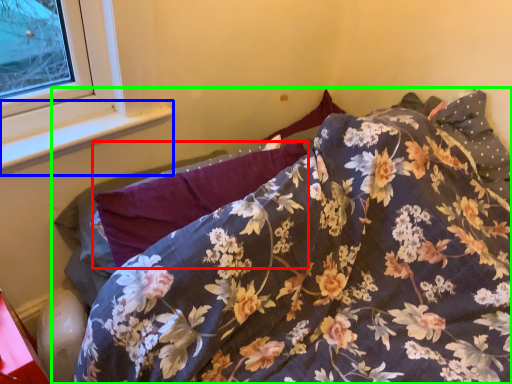
Question: Based on their relative distances, which object is nearer to pillow (highlighted by a red box)? Choose from window sill (highlighted by a blue box) and bed (highlighted by a green box).

Choices:
 (A) window sill
 (B) bed

Answer: (B)